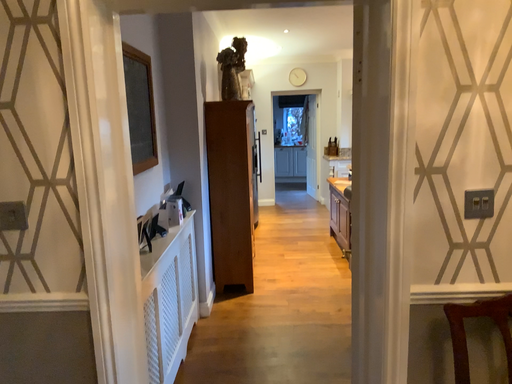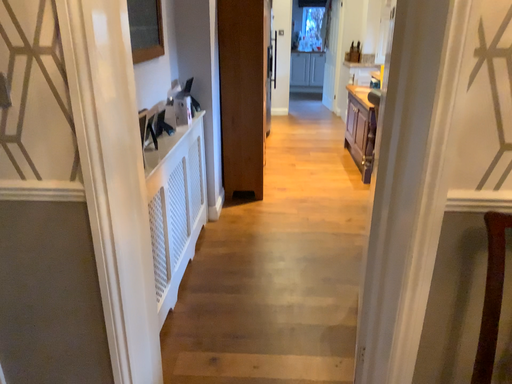
Question: Which way did the camera rotate in the video?

Choices:
 (A) rotated upward
 (B) rotated downward

Answer: (B)